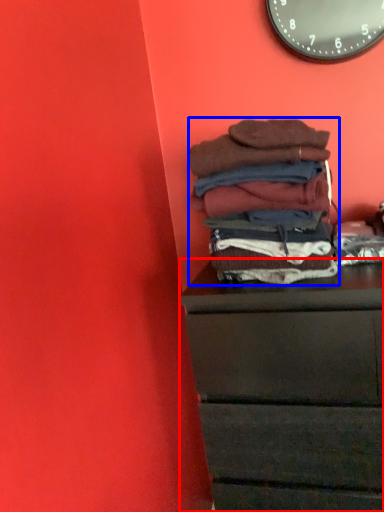
Question: Which object is further to the camera taking this photo, chest of drawers (highlighted by a red box) or material (highlighted by a blue box)?

Choices:
 (A) chest of drawers
 (B) material

Answer: (B)